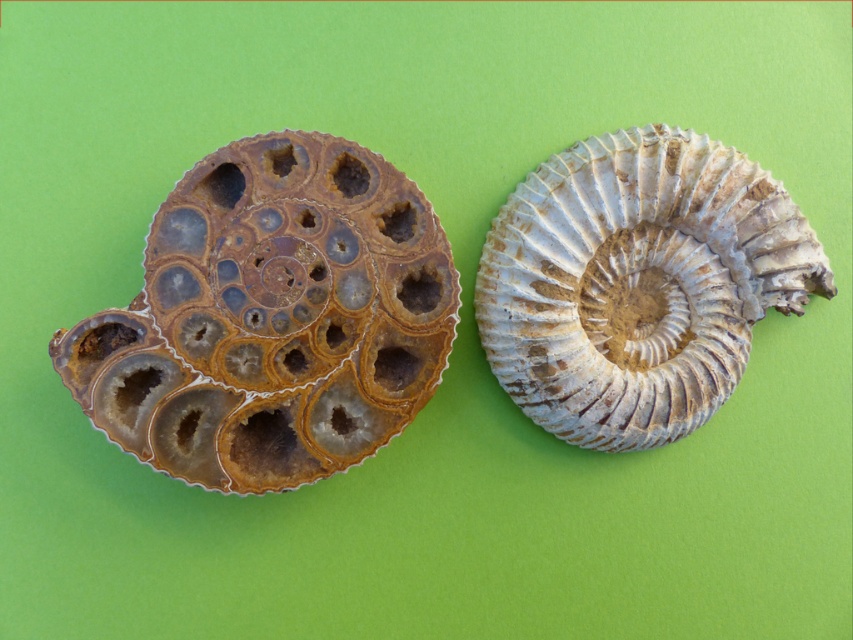
Question: Is translucent amber fossil at left above white textured fossil at center?

Choices:
 (A) no
 (B) yes

Answer: (A)

Question: Can you confirm if translucent amber fossil at left is wider than white textured fossil at center?

Choices:
 (A) yes
 (B) no

Answer: (A)

Question: Among these points, which one is nearest to the camera?

Choices:
 (A) (701, 400)
 (B) (115, 355)

Answer: (B)

Question: Considering the relative positions of translucent amber fossil at left and white textured fossil at center in the image provided, where is translucent amber fossil at left located with respect to white textured fossil at center?

Choices:
 (A) below
 (B) above

Answer: (A)

Question: Which of the following is the farthest from the observer?

Choices:
 (A) (740, 212)
 (B) (250, 268)

Answer: (A)